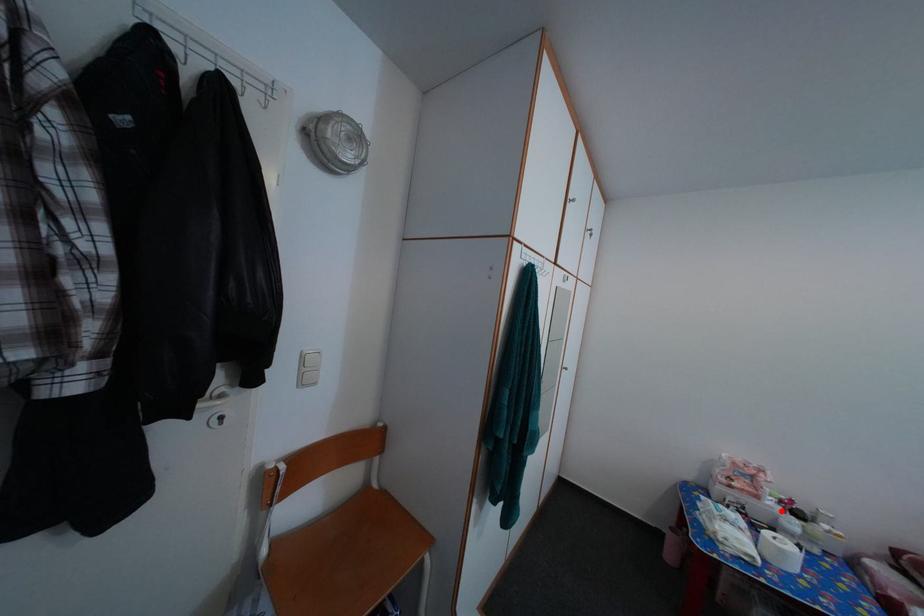
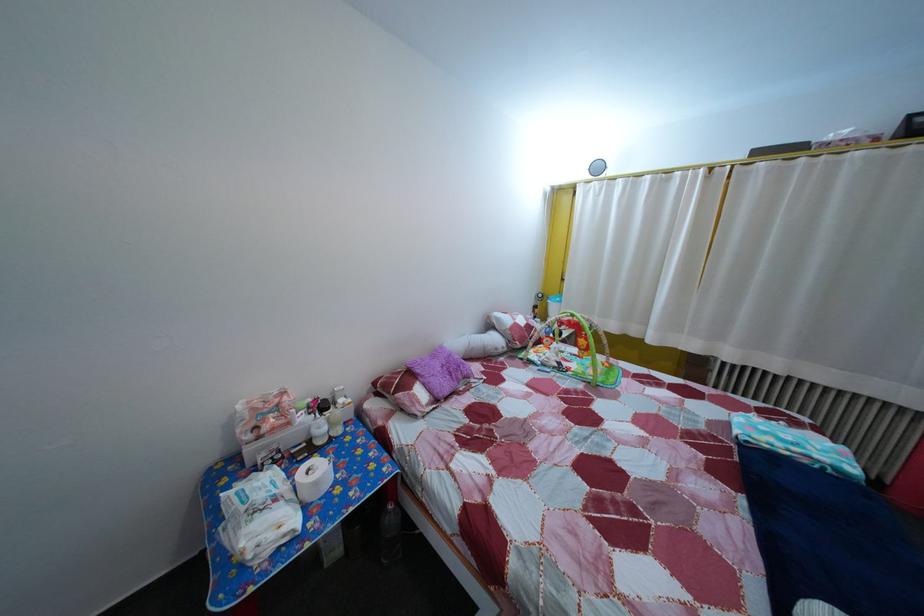
Question: I am providing you with two images of the same scene from different viewpoints. A red point is shown in image1. For the corresponding object point in image2, is it positioned nearer or farther from the camera?

Choices:
 (A) Nearer
 (B) Farther

Answer: (B)